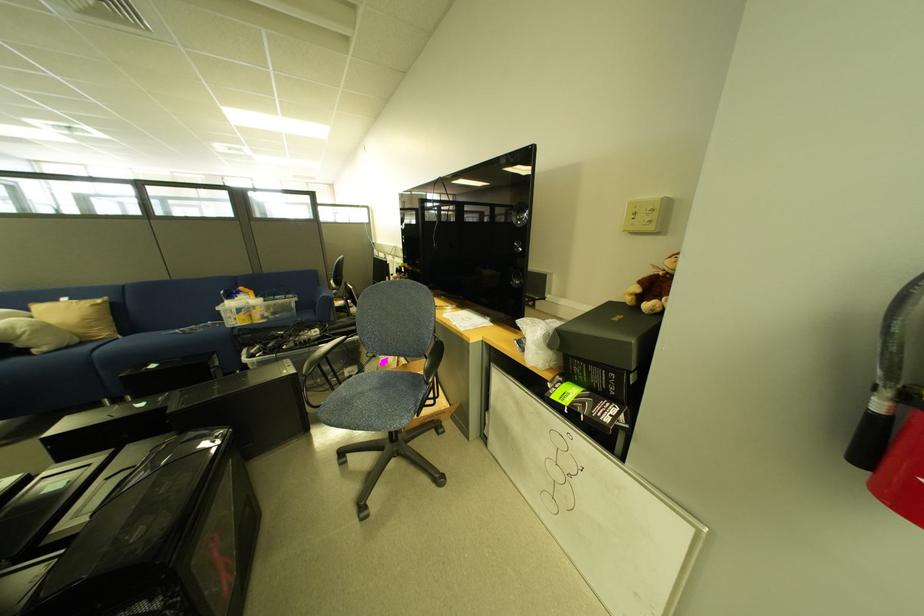
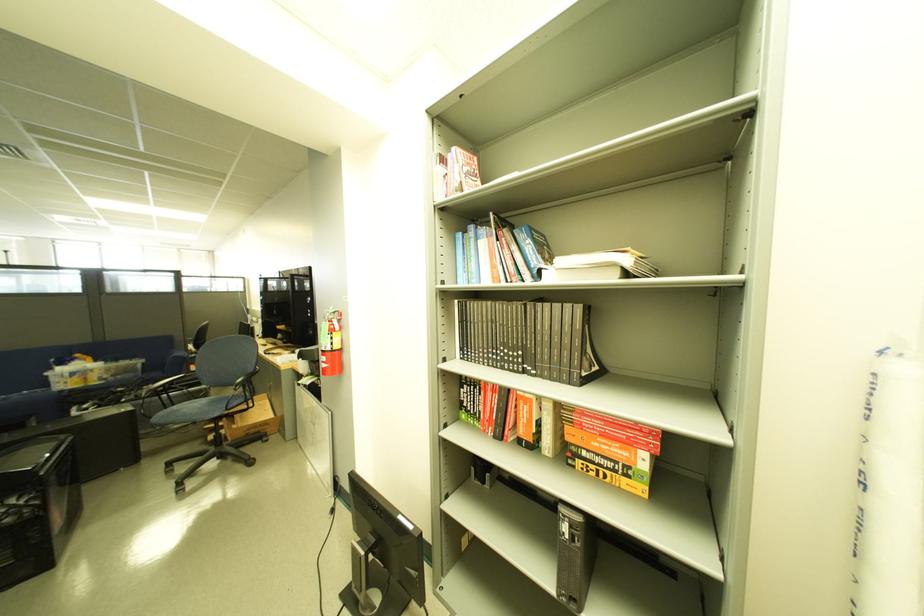
Where in the second image is the point corresponding to (254,322) from the first image?

(88, 385)